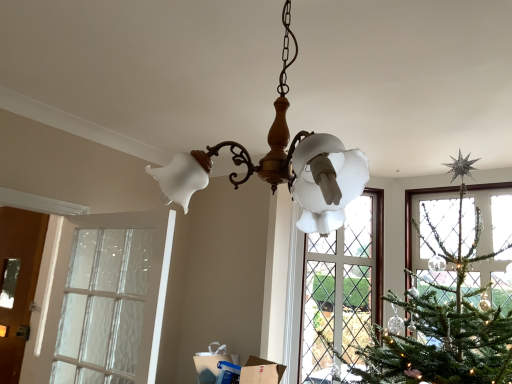
Question: Does clear glass door at left appear on the right side of matte white glass chandelier at center?

Choices:
 (A) yes
 (B) no

Answer: (B)

Question: From the image's perspective, does clear glass door at left appear higher than matte white glass chandelier at center?

Choices:
 (A) yes
 (B) no

Answer: (B)

Question: Does clear glass door at left appear on the left side of matte white glass chandelier at center?

Choices:
 (A) yes
 (B) no

Answer: (A)

Question: Is clear glass door at left positioned beyond the bounds of matte white glass chandelier at center?

Choices:
 (A) no
 (B) yes

Answer: (B)

Question: Considering the relative positions of clear glass door at left and matte white glass chandelier at center in the image provided, is clear glass door at left in front of matte white glass chandelier at center?

Choices:
 (A) yes
 (B) no

Answer: (B)

Question: Considering the positions of clear glass door at left and brown wooden door at left in the image, is clear glass door at left taller or shorter than brown wooden door at left?

Choices:
 (A) tall
 (B) short

Answer: (B)

Question: Is point (130, 319) closer or farther from the camera than point (10, 241)?

Choices:
 (A) farther
 (B) closer

Answer: (B)

Question: From a real-world perspective, relative to brown wooden door at left, is clear glass door at left vertically above or below?

Choices:
 (A) above
 (B) below

Answer: (A)

Question: Relative to brown wooden door at left, is clear glass door at left in front or behind?

Choices:
 (A) front
 (B) behind

Answer: (A)

Question: Relative to clear glass door at left, is brown wooden door at left in front or behind?

Choices:
 (A) front
 (B) behind

Answer: (B)

Question: Does point (28, 251) appear closer or farther from the camera than point (117, 329)?

Choices:
 (A) closer
 (B) farther

Answer: (B)

Question: From the image's perspective, is brown wooden door at left above or below clear glass door at left?

Choices:
 (A) above
 (B) below

Answer: (B)

Question: Which is correct: brown wooden door at left is inside clear glass door at left, or outside of it?

Choices:
 (A) inside
 (B) outside

Answer: (B)

Question: Is point (310, 163) closer or farther from the camera than point (74, 256)?

Choices:
 (A) closer
 (B) farther

Answer: (A)

Question: Considering the positions of matte white glass chandelier at center and clear glass door at left in the image, is matte white glass chandelier at center wider or thinner than clear glass door at left?

Choices:
 (A) wide
 (B) thin

Answer: (A)